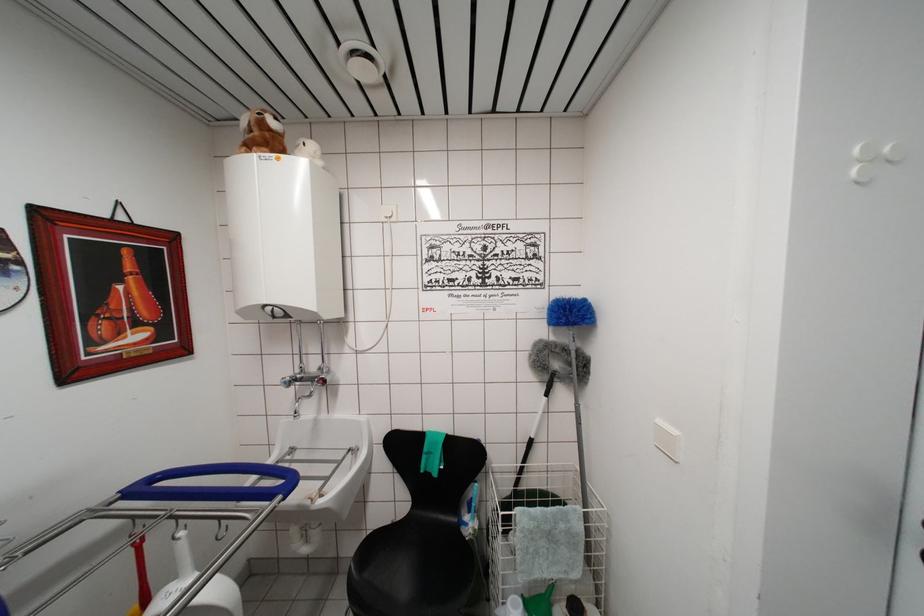
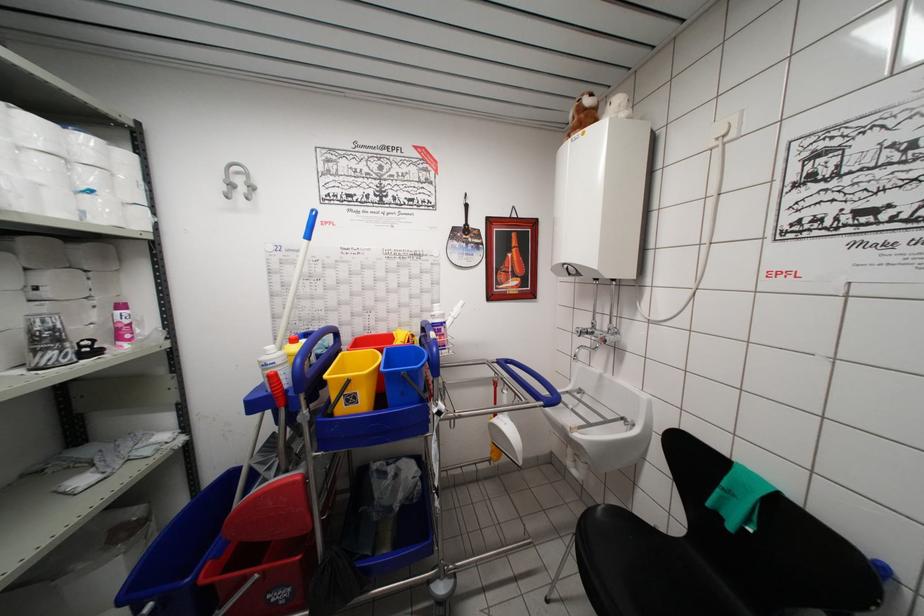
Question: How did the camera likely rotate?

Choices:
 (A) Left
 (B) Right
 (C) Up
 (D) Down

Answer: (A)